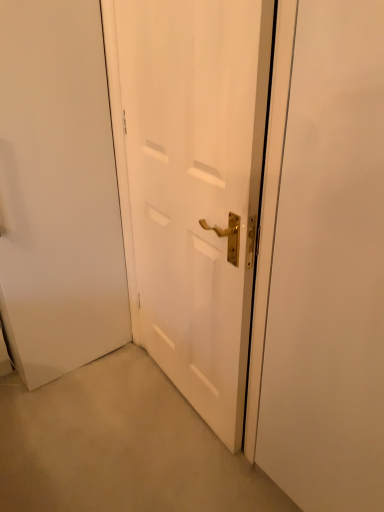
Question: In terms of height, does white matte door at center look taller or shorter compared to white matte door at center?

Choices:
 (A) tall
 (B) short

Answer: (B)

Question: Visually, is white matte door at center positioned to the left or to the right of white matte door at center?

Choices:
 (A) right
 (B) left

Answer: (A)

Question: From the image's perspective, is white matte door at center located above or below white matte door at center?

Choices:
 (A) below
 (B) above

Answer: (A)

Question: In the image, is white matte door at center positioned in front of or behind white matte door at center?

Choices:
 (A) front
 (B) behind

Answer: (B)

Question: From a real-world perspective, is white matte door at center positioned above or below white matte door at center?

Choices:
 (A) below
 (B) above

Answer: (B)

Question: Is white matte door at center inside or outside of white matte door at center?

Choices:
 (A) inside
 (B) outside

Answer: (B)

Question: In terms of height, does white matte door at center look taller or shorter compared to white matte door at center?

Choices:
 (A) tall
 (B) short

Answer: (A)